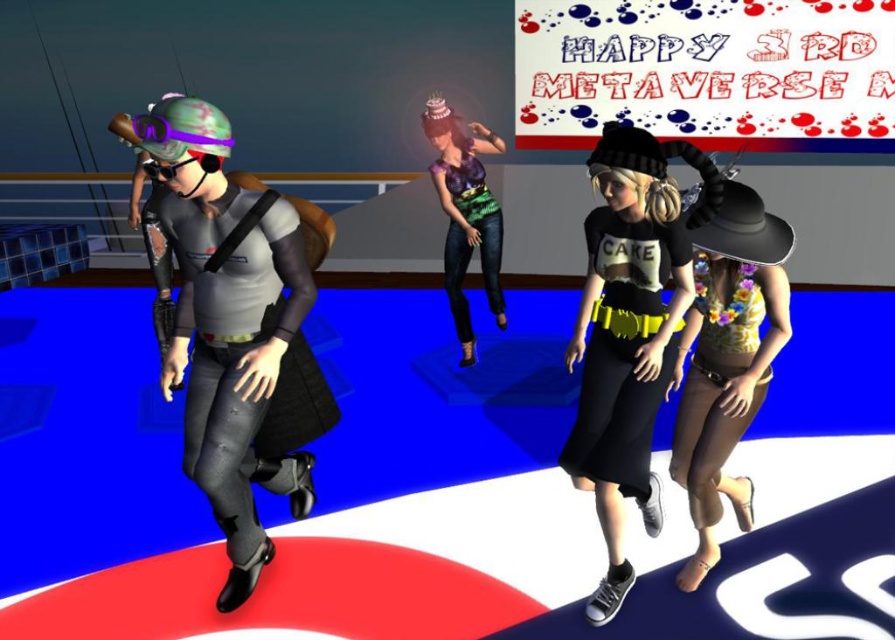
Does shiny metallic helmet at left have a greater width compared to black matte t-shirt at center?

Yes, shiny metallic helmet at left is wider than black matte t-shirt at center.

Does point (175, 200) come behind point (631, 266)?

No, it is not.

Which is in front, point (226, 548) or point (634, 237)?

Point (634, 237) is more forward.

At what (x,y) coordinates should I click in order to perform the action: click on shiny metallic helmet at left. Please return your answer as a coordinate pair (x, y). Looking at the image, I should click on coord(235,333).

Does point (721, 186) come behind point (716, 442)?

No, (721, 186) is closer to viewer.

Is black matte t-shirt at center positioned at the back of floral yellow tank top at center?

No, black matte t-shirt at center is closer to the viewer.

Who is more distant from viewer, (x=665, y=328) or (x=737, y=275)?

The point (x=737, y=275) is behind.

Find the location of a particular element. black matte t-shirt at center is located at coordinates (628, 332).

Who is more forward, (x=239, y=552) or (x=683, y=433)?

Point (x=239, y=552) is more forward.

Which is more to the right, shiny metallic helmet at left or floral yellow tank top at center?

floral yellow tank top at center

Measure the distance between point (217, 257) and camera.

A distance of 6.86 feet exists between point (217, 257) and camera.

Where is `shiny metallic helmet at left`? shiny metallic helmet at left is located at coordinates (235, 333).